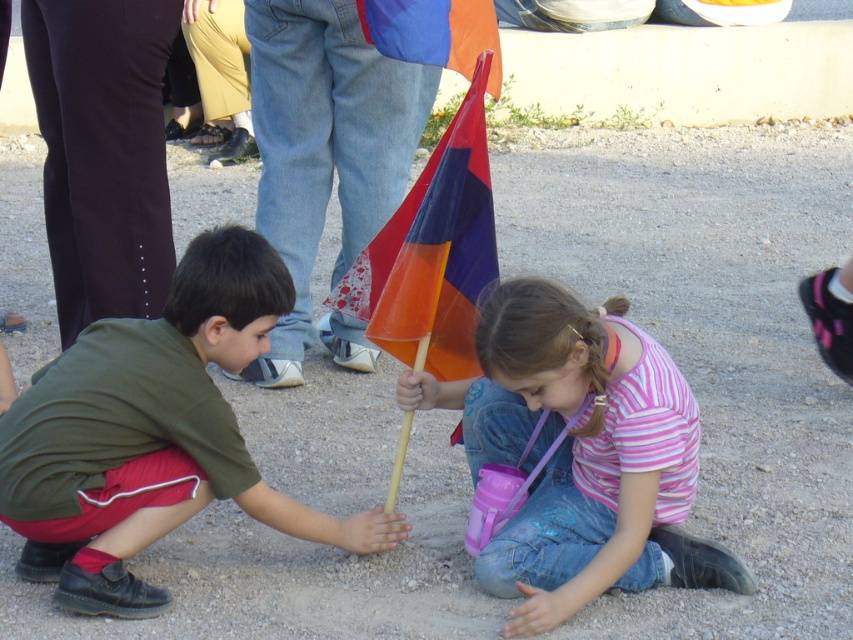
Question: Among these objects, which one is farthest from the camera?

Choices:
 (A) translucent plastic flag at center
 (B) green matte shirt at lower left

Answer: (A)

Question: Which is farther from the translucent plastic flag at center?

Choices:
 (A) pink striped shirt at center
 (B) green matte shirt at lower left
 (C) orange fabric flag at upper center

Answer: (B)

Question: Can you confirm if green matte shirt at lower left is positioned to the left of translucent plastic flag at center?

Choices:
 (A) yes
 (B) no

Answer: (A)

Question: Which object is the closest to the green matte shirt at lower left?

Choices:
 (A) orange fabric flag at upper center
 (B) translucent plastic flag at center

Answer: (B)

Question: Is pink striped shirt at center wider than orange fabric flag at upper center?

Choices:
 (A) yes
 (B) no

Answer: (A)

Question: Can you confirm if green matte shirt at lower left is positioned to the left of pink striped shirt at center?

Choices:
 (A) no
 (B) yes

Answer: (B)